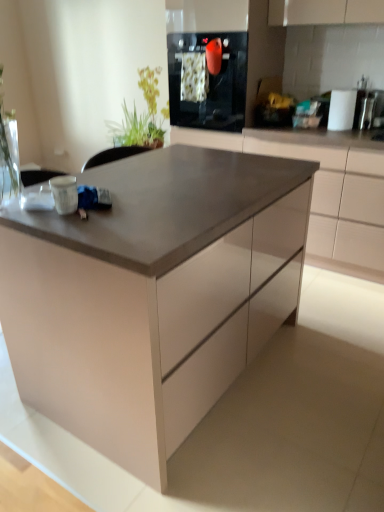
Question: Would you say green leafy plant at upper left is inside or outside matte white cabinet at center?

Choices:
 (A) inside
 (B) outside

Answer: (B)

Question: Is green leafy plant at upper left taller or shorter than matte white cabinet at center?

Choices:
 (A) short
 (B) tall

Answer: (A)

Question: Which object is the closest to the matte gray table at center?

Choices:
 (A) green leafy plant at upper left
 (B) matte white cabinet at center
 (C) black glass oven at upper center

Answer: (B)

Question: Which is farther from the matte gray table at center?

Choices:
 (A) black glass oven at upper center
 (B) green leafy plant at upper left
 (C) matte white cabinet at center

Answer: (B)